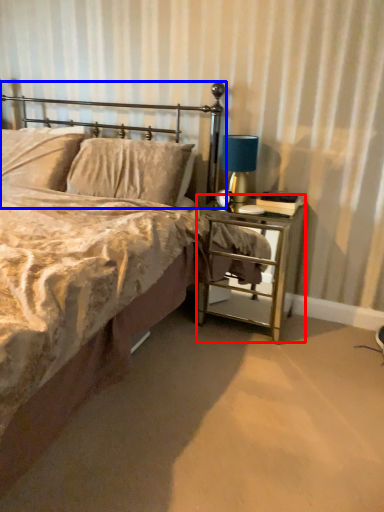
Question: Among these objects, which one is nearest to the camera, nightstand (highlighted by a red box) or headboard (highlighted by a blue box)?

Choices:
 (A) nightstand
 (B) headboard

Answer: (A)